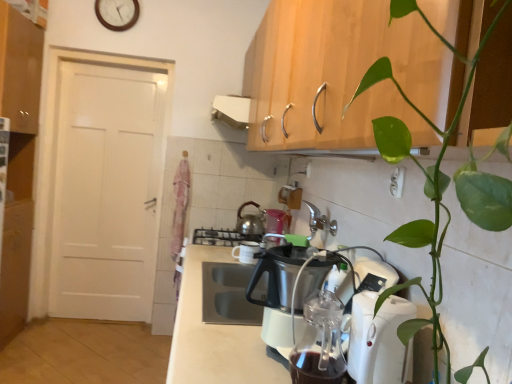
Question: Is shiny metallic kettle at center, placed as the 1th kitchen appliance when sorted from left to right, to the left or to the right of white plastic electric outlet at upper center in the image?

Choices:
 (A) right
 (B) left

Answer: (B)

Question: From a real-world perspective, is shiny metallic kettle at center, arranged as the second kitchen appliance when viewed from the front, positioned above or below white plastic electric outlet at upper center?

Choices:
 (A) below
 (B) above

Answer: (A)

Question: Considering the real-world distances, which object is farthest from the white plastic electric outlet at upper center?

Choices:
 (A) white wooden clock at upper center
 (B) shiny metallic kettle at center, arranged as the second kitchen appliance when viewed from the front
 (C) white plastic kettle at lower right, marked as the second kitchen appliance in a left-to-right arrangement
 (D) matte wood cabinet at upper left
 (E) white plastic countertop at center

Answer: (A)

Question: Which object is positioned closest to the matte wood cabinet at upper left?

Choices:
 (A) white wooden clock at upper center
 (B) white plastic kettle at lower right, positioned as the first kitchen appliance in right-to-left order
 (C) white plastic countertop at center
 (D) white plastic electric outlet at upper center
 (E) shiny metallic kettle at center, arranged as the second kitchen appliance when viewed from the front

Answer: (A)